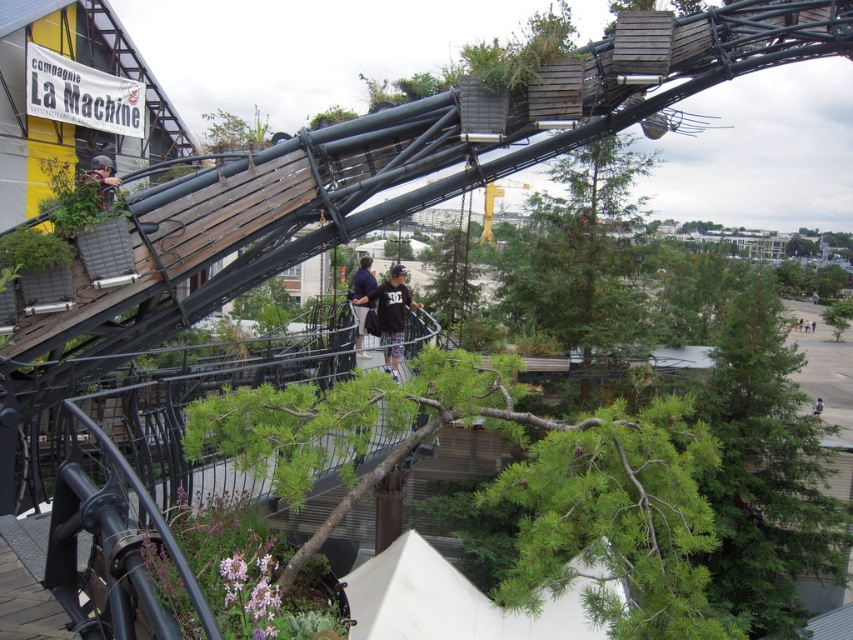
You are a visitor at the urban landscape and want to know if the matte black helmet at upper left can be seen over the dark blue jeans at center from your current viewpoint. Based on their heights, what do you think?

The matte black helmet at upper left is taller than the dark blue jeans at center, so yes, the matte black helmet at upper left can be seen over the dark blue jeans at center from your current viewpoint.